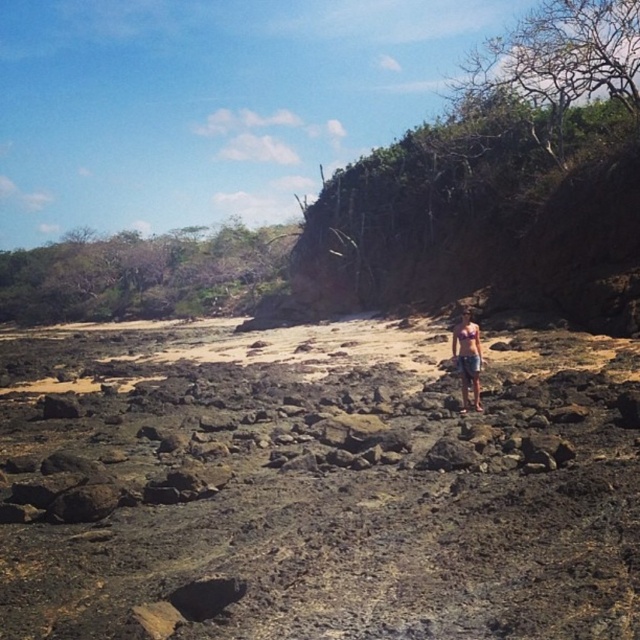
Who is positioned more to the right, dark brown lava rocks at center or matte pink bikini top at center?

From the viewer's perspective, matte pink bikini top at center appears more on the right side.

Does point (45, 506) lie behind point (468, 380)?

No, (45, 506) is closer to viewer.

Locate an element on the screen. dark brown lava rocks at center is located at coordinates (316, 484).